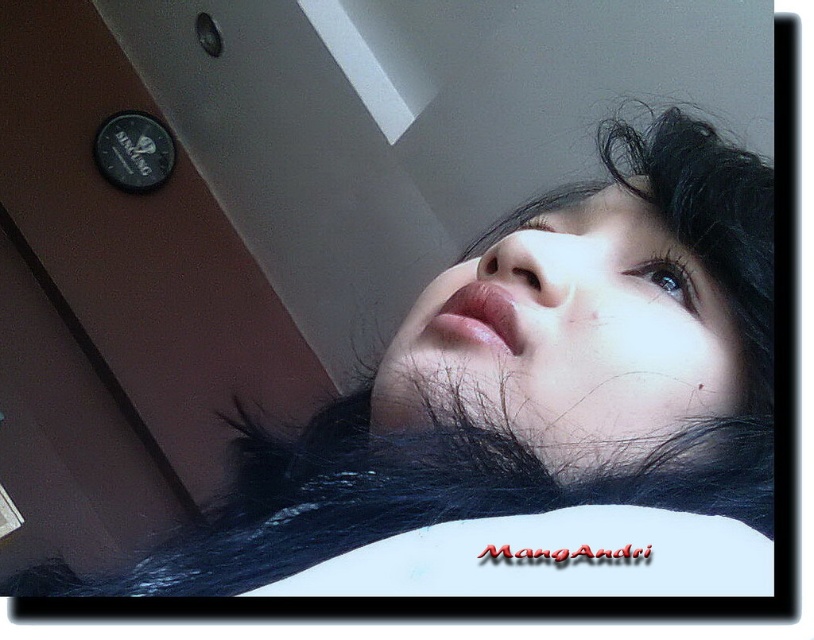
Question: Which of these objects is positioned farthest from the matte black eye at upper center?

Choices:
 (A) smooth skin face at upper center
 (B) black glossy eye at upper center

Answer: (A)

Question: Considering the relative positions of black glossy eye at upper center and matte black eye at upper center in the image provided, where is black glossy eye at upper center located with respect to matte black eye at upper center?

Choices:
 (A) above
 (B) below

Answer: (B)

Question: Which point is closer to the camera?

Choices:
 (A) matte black eye at upper center
 (B) smooth skin face at upper center
 (C) black glossy eye at upper center

Answer: (B)

Question: Which object appears closest to the camera in this image?

Choices:
 (A) black glossy eye at upper center
 (B) matte black eye at upper center
 (C) smooth skin face at upper center

Answer: (C)

Question: Can you confirm if smooth skin face at upper center is positioned to the left of matte black eye at upper center?

Choices:
 (A) yes
 (B) no

Answer: (A)

Question: Can you confirm if smooth skin face at upper center is positioned below black glossy eye at upper center?

Choices:
 (A) yes
 (B) no

Answer: (A)